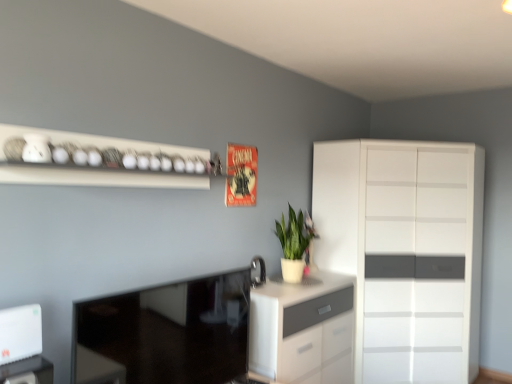
Question: From the image's perspective, does white plastic router at lower left, the 2th appliance in the back-to-front sequence, appear higher than satin nickel faucet at center, marked as the 1th appliance in a back-to-front arrangement?

Choices:
 (A) yes
 (B) no

Answer: (B)

Question: Can you confirm if white plastic router at lower left, positioned as the first appliance in front-to-back order, is bigger than satin nickel faucet at center, acting as the second appliance starting from the left?

Choices:
 (A) yes
 (B) no

Answer: (A)

Question: From the image's perspective, is white plastic router at lower left, which is the 1th appliance in left-to-right order, below satin nickel faucet at center, which is counted as the second appliance, starting from the front?

Choices:
 (A) no
 (B) yes

Answer: (B)

Question: Considering the relative positions of white plastic router at lower left, positioned as the 2th appliance in right-to-left order, and satin nickel faucet at center, which is counted as the second appliance, starting from the front, in the image provided, is white plastic router at lower left, positioned as the 2th appliance in right-to-left order, behind satin nickel faucet at center, which is counted as the second appliance, starting from the front,?

Choices:
 (A) no
 (B) yes

Answer: (A)

Question: Does white plastic router at lower left, positioned as the first appliance in front-to-back order, appear on the left side of satin nickel faucet at center, which is counted as the second appliance, starting from the front?

Choices:
 (A) no
 (B) yes

Answer: (B)

Question: Does point (290, 206) appear closer or farther from the camera than point (24, 168)?

Choices:
 (A) closer
 (B) farther

Answer: (B)

Question: From their relative heights in the image, would you say green matte plant at center is taller or shorter than white glossy shelf at upper left?

Choices:
 (A) short
 (B) tall

Answer: (B)

Question: From the image's perspective, is green matte plant at center positioned above or below white glossy shelf at upper left?

Choices:
 (A) below
 (B) above

Answer: (A)

Question: Is green matte plant at center bigger or smaller than white glossy shelf at upper left?

Choices:
 (A) big
 (B) small

Answer: (B)

Question: From the image's perspective, is satin nickel faucet at center, which is counted as the second appliance, starting from the front, positioned above or below green matte plant at center?

Choices:
 (A) below
 (B) above

Answer: (A)

Question: From a real-world perspective, is satin nickel faucet at center, which is counted as the second appliance, starting from the front, physically located above or below green matte plant at center?

Choices:
 (A) above
 (B) below

Answer: (B)

Question: Looking at their shapes, would you say satin nickel faucet at center, marked as the first appliance in a right-to-left arrangement, is wider or thinner than green matte plant at center?

Choices:
 (A) wide
 (B) thin

Answer: (B)

Question: In terms of size, does satin nickel faucet at center, acting as the second appliance starting from the left, appear bigger or smaller than green matte plant at center?

Choices:
 (A) big
 (B) small

Answer: (B)

Question: Considering the positions of white plastic router at lower left, the 2th appliance in the back-to-front sequence, and white glossy cupboard at right in the image, is white plastic router at lower left, the 2th appliance in the back-to-front sequence, taller or shorter than white glossy cupboard at right?

Choices:
 (A) tall
 (B) short

Answer: (B)

Question: Considering the positions of point (10, 355) and point (435, 150), is point (10, 355) closer or farther from the camera than point (435, 150)?

Choices:
 (A) closer
 (B) farther

Answer: (A)